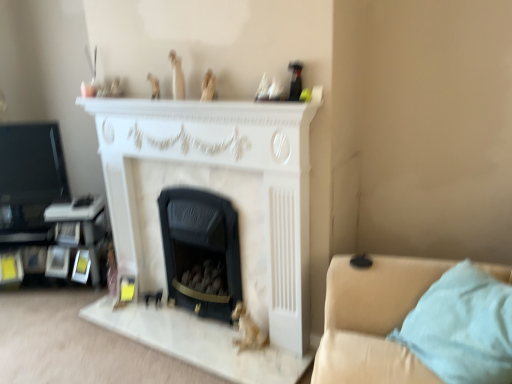
Question: Does matte beige figurine at upper center, arranged as the 3th toy when viewed from the left, appear on the right side of gold metallic figurine at lower center, the 1th toy ordered from the bottom?

Choices:
 (A) no
 (B) yes

Answer: (A)

Question: Would you say matte beige figurine at upper center, arranged as the 3th toy when viewed from the left, contains gold metallic figurine at lower center, the 1th toy ordered from the bottom?

Choices:
 (A) no
 (B) yes

Answer: (A)

Question: Is matte beige figurine at upper center, arranged as the 3th toy when viewed from the left, positioned behind gold metallic figurine at lower center, which is the fourth toy from top to bottom?

Choices:
 (A) no
 (B) yes

Answer: (A)

Question: Could you tell me if matte beige figurine at upper center, arranged as the 3th toy when viewed from the left, is turned towards gold metallic figurine at lower center, which is the fourth toy in left-to-right order?

Choices:
 (A) no
 (B) yes

Answer: (A)

Question: Considering the relative sizes of matte beige figurine at upper center, acting as the second toy starting from the right, and gold metallic figurine at lower center, acting as the 1th toy starting from the right, in the image provided, is matte beige figurine at upper center, acting as the second toy starting from the right, smaller than gold metallic figurine at lower center, acting as the 1th toy starting from the right,?

Choices:
 (A) yes
 (B) no

Answer: (A)

Question: Is white matte statue at upper center, the fourth toy positioned from the bottom, bigger or smaller than white marble fireplace at center, which is the 2th fireplace from right to left?

Choices:
 (A) big
 (B) small

Answer: (B)

Question: In terms of width, does white matte statue at upper center, the third toy positioned from the right, look wider or thinner when compared to white marble fireplace at center, which is the 2th fireplace from right to left?

Choices:
 (A) thin
 (B) wide

Answer: (A)

Question: Would you say white matte statue at upper center, the 2th toy viewed from the left, is to the left or to the right of white marble fireplace at center, which is the 1th fireplace in left-to-right order, in the picture?

Choices:
 (A) right
 (B) left

Answer: (B)

Question: In the image, is white matte statue at upper center, the first toy positioned from the top, positioned in front of or behind white marble fireplace at center, which is the 1th fireplace in left-to-right order?

Choices:
 (A) front
 (B) behind

Answer: (B)

Question: Is matte beige figurine at upper center, acting as the second toy starting from the bottom, in front of or behind gold metallic figurine at lower center, the 1th toy ordered from the bottom, in the image?

Choices:
 (A) behind
 (B) front

Answer: (B)

Question: In terms of size, does matte beige figurine at upper center, arranged as the 3th toy when viewed from the left, appear bigger or smaller than gold metallic figurine at lower center, which is the fourth toy from top to bottom?

Choices:
 (A) big
 (B) small

Answer: (B)

Question: Which is correct: matte beige figurine at upper center, acting as the second toy starting from the bottom, is inside gold metallic figurine at lower center, the 1th toy ordered from the bottom, or outside of it?

Choices:
 (A) inside
 (B) outside

Answer: (B)

Question: Is point (210, 91) positioned closer to the camera than point (237, 311)?

Choices:
 (A) farther
 (B) closer

Answer: (B)

Question: Considering the relative positions of white matte statue at upper center, the first toy positioned from the top, and wooden figurine at upper center, which ranks as the 4th toy in right-to-left order, in the image provided, is white matte statue at upper center, the first toy positioned from the top, to the left or to the right of wooden figurine at upper center, which ranks as the 4th toy in right-to-left order,?

Choices:
 (A) left
 (B) right

Answer: (B)

Question: From their relative heights in the image, would you say white matte statue at upper center, the first toy positioned from the top, is taller or shorter than wooden figurine at upper center, which appears as the 2th toy when viewed from the top?

Choices:
 (A) tall
 (B) short

Answer: (A)